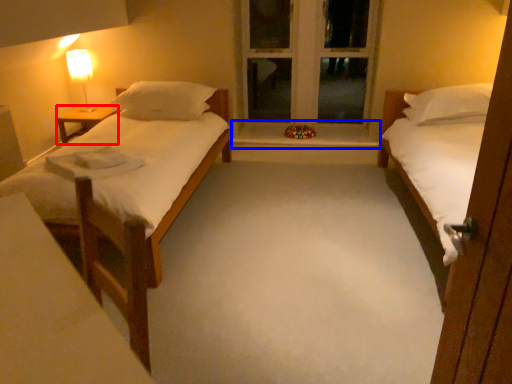
Question: Which point is closer to the camera, nightstand (highlighted by a red box) or window sill (highlighted by a blue box)?

Choices:
 (A) nightstand
 (B) window sill

Answer: (A)